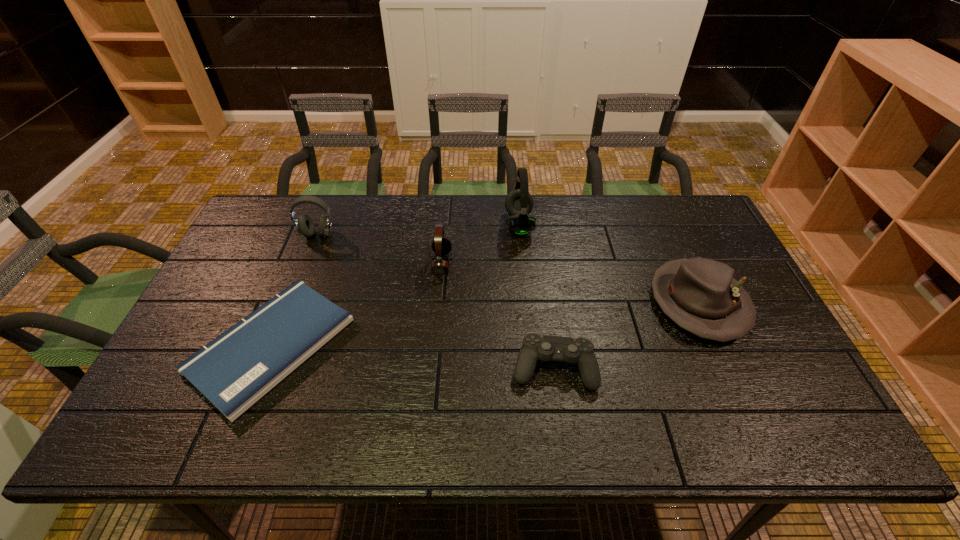
You are a GUI agent. You are given a task and a screenshot of the screen. Output one action in this format:
    pyautogui.click(x=<x>, y=<y>)
    Task: Click on the vacant space located on the ear cups of the rightmost headset
    
    Given the screenshot: What is the action you would take?
    pyautogui.click(x=445, y=225)

Locate an element on the screen. free space located 0.170m on the ear cups of the rightmost headset is located at coordinates (454, 225).

Identify the location of vacant area located 0.390m on the ear cups of the leftmost headset. This screenshot has width=960, height=540. (276, 342).

What are the coordinates of `vacant area situated on the ear pads of the nearest headset` in the screenshot? It's located at (572, 263).

The height and width of the screenshot is (540, 960). Identify the location of vacant space located on the decorative side of the rightmost object. (730, 373).

I want to click on free space located on the right of the control, so click(684, 368).

At what (x,y) coordinates should I click in order to perform the action: click on free point located 0.270m on the right of the shortest object. Please return your answer as a coordinate pair (x, y). Looking at the image, I should click on (452, 345).

You are a GUI agent. You are given a task and a screenshot of the screen. Output one action in this format:
    pyautogui.click(x=<x>, y=<y>)
    Task: Click on the object positioned at the near edge
    This screenshot has height=540, width=960.
    Given the screenshot: What is the action you would take?
    pyautogui.click(x=236, y=369)

This screenshot has height=540, width=960. In order to click on object present at the left edge in this screenshot , I will do `click(236, 369)`.

At what (x,y) coordinates should I click in order to perform the action: click on object situated at the right edge. Please return your answer as a coordinate pair (x, y). Looking at the image, I should click on (700, 295).